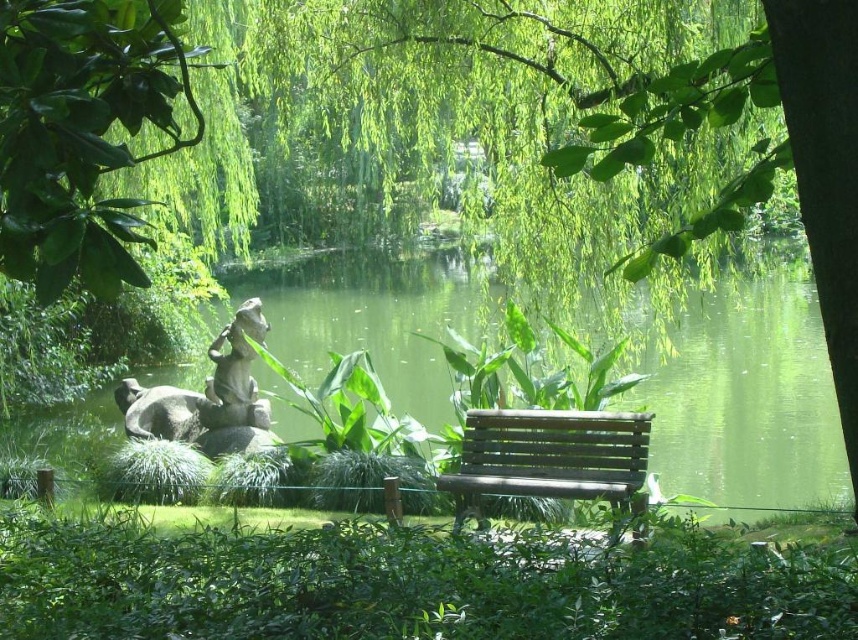
Does green leafy tree at upper left come in front of gray stone statue at center-left?

Yes.

Does green leafy tree at upper left have a smaller size compared to gray stone statue at center-left?

Correct, green leafy tree at upper left occupies less space than gray stone statue at center-left.

Is point (57, 291) closer to camera compared to point (140, 396)?

That is True.

Find the location of a particular element. Image resolution: width=858 pixels, height=640 pixels. green leafy tree at upper left is located at coordinates (83, 132).

Is green leafy tree at center to the left of green water at center from the viewer's perspective?

No, green leafy tree at center is not to the left of green water at center.

Can you confirm if green leafy tree at center is smaller than green water at center?

Incorrect, green leafy tree at center is not smaller in size than green water at center.

Which is in front, point (675, 83) or point (417, 408)?

Point (675, 83) is more forward.

Locate an element on the screen. green leafy tree at center is located at coordinates (577, 116).

Is green water at center below green leafy tree at upper left?

Yes, green water at center is below green leafy tree at upper left.

This screenshot has height=640, width=858. Identify the location of green water at center. (746, 397).

Locate an element on the screen. The image size is (858, 640). green water at center is located at coordinates (746, 397).